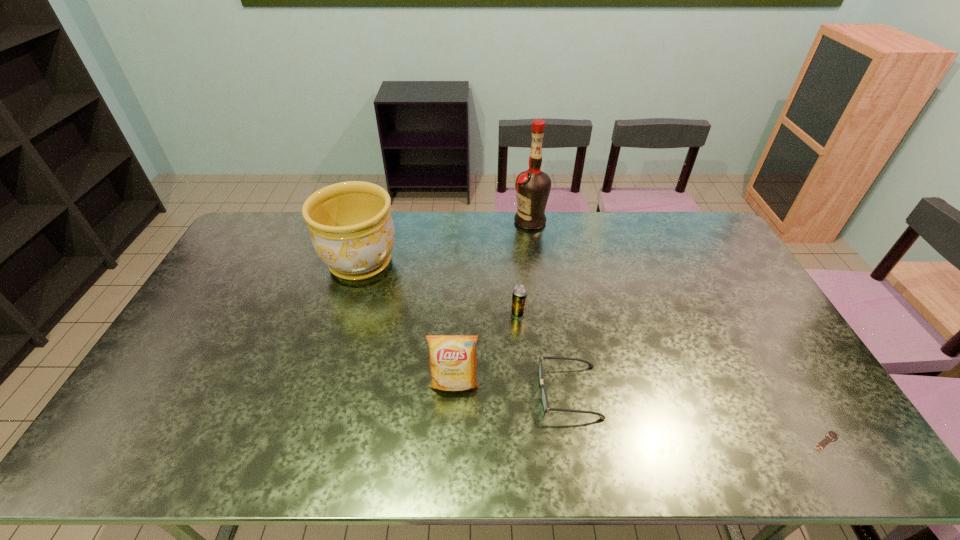
Image resolution: width=960 pixels, height=540 pixels. I want to click on the rightmost object, so click(831, 435).

Identify the location of blank space located on the front and back of the liquor. The width and height of the screenshot is (960, 540). (429, 221).

The height and width of the screenshot is (540, 960). I want to click on vacant region located 0.330m on the front and back of the liquor, so click(x=429, y=221).

In order to click on vacant space situated on the front and back of the liquor in this screenshot , I will do `click(444, 221)`.

Find the location of a particular element. free location located 0.140m on the back of the fifth nearest object is located at coordinates (374, 217).

Locate an element on the screen. The width and height of the screenshot is (960, 540). free space located 0.050m on the front-facing side of the fourth shortest object is located at coordinates (453, 414).

At what (x,y) coordinates should I click in order to perform the action: click on vacant space located 0.070m on the back of the beer can. Please return your answer as a coordinate pair (x, y). The height and width of the screenshot is (540, 960). Looking at the image, I should click on (516, 293).

The width and height of the screenshot is (960, 540). Identify the location of vacant space located 0.230m on the face of the fifth tallest object. (452, 392).

Find the location of `free spot located on the face of the fifth tallest object`. free spot located on the face of the fifth tallest object is located at coordinates (442, 392).

The height and width of the screenshot is (540, 960). In order to click on free space located 0.160m on the face of the fifth tallest object in this screenshot , I will do `click(479, 392)`.